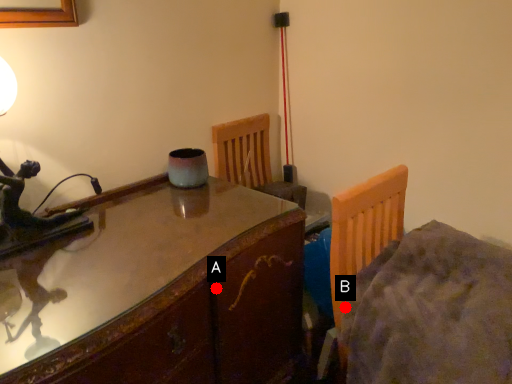
Question: Two points are circled on the image, labeled by A and B beside each circle. Which point is closer to the camera?

Choices:
 (A) A is closer
 (B) B is closer

Answer: (A)